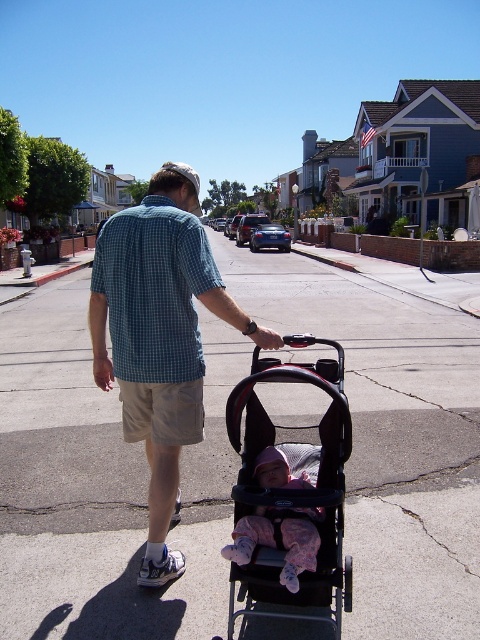
Question: Does black textured baby carriage at center appear on the right side of pink fleece baby at center?

Choices:
 (A) no
 (B) yes

Answer: (B)

Question: Which is nearer to the black textured baby carriage at center?

Choices:
 (A) blue checkered shirt at back
 (B) pink fleece baby at center
 (C) blue checkered shirt at center
 (D) gray asphalt pavement at center

Answer: (B)

Question: Among these objects, which one is nearest to the camera?

Choices:
 (A) gray asphalt pavement at center
 (B) pink fleece baby at center

Answer: (B)

Question: Observing the image, what is the correct spatial positioning of black textured baby carriage at center in reference to blue checkered shirt at back?

Choices:
 (A) above
 (B) below

Answer: (B)

Question: Can you confirm if black textured baby carriage at center is bigger than pink fleece baby at center?

Choices:
 (A) yes
 (B) no

Answer: (A)

Question: Among these points, which one is nearest to the camera?

Choices:
 (A) (276, 541)
 (B) (260, 500)

Answer: (B)